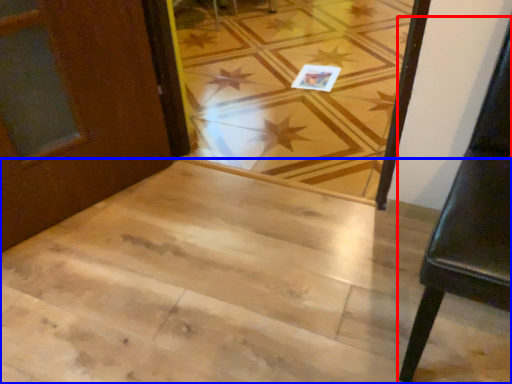
Question: Which object is closer to the camera taking this photo, furniture (highlighted by a red box) or stairwell (highlighted by a blue box)?

Choices:
 (A) furniture
 (B) stairwell

Answer: (A)